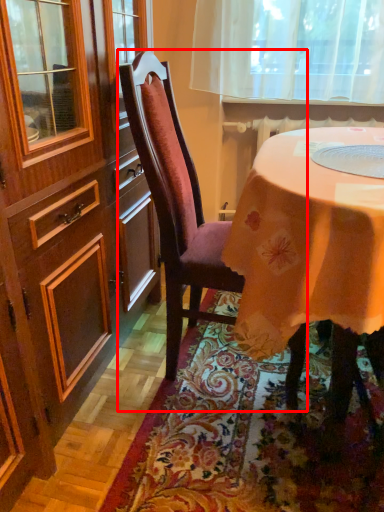
Question: From the image's perspective, where is chair (annotated by the red box) located in relation to mat in the image?

Choices:
 (A) below
 (B) above

Answer: (B)